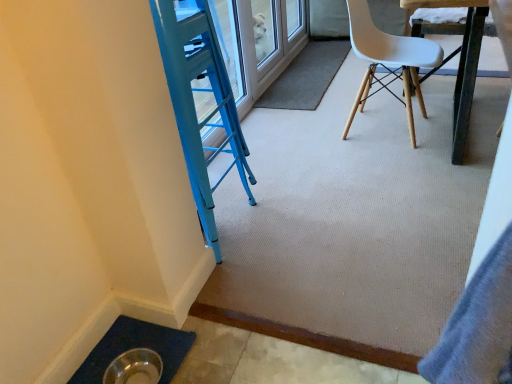
Find the location of a particular element. Image resolution: width=512 pixels, height=384 pixels. vacant space in front of white plastic chair at upper right is located at coordinates (376, 167).